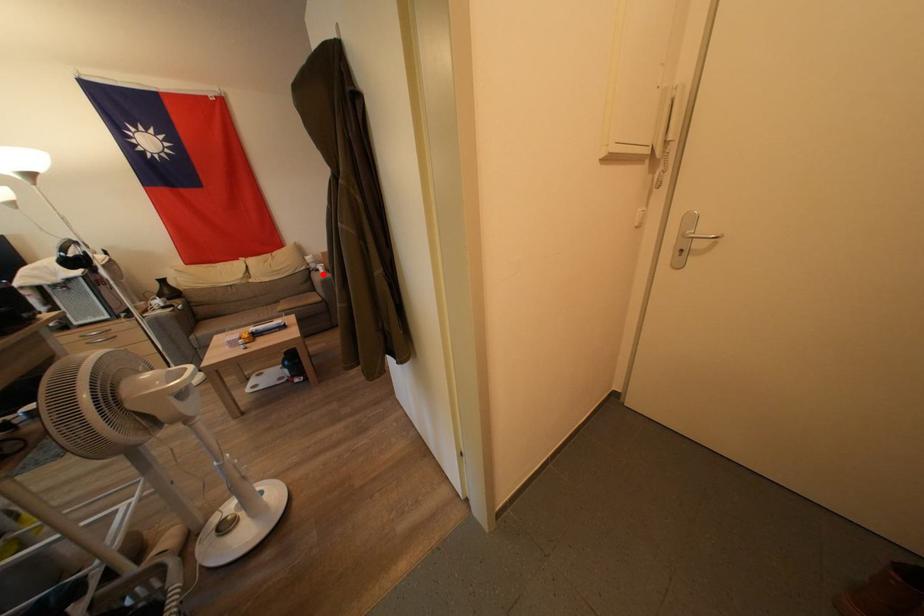
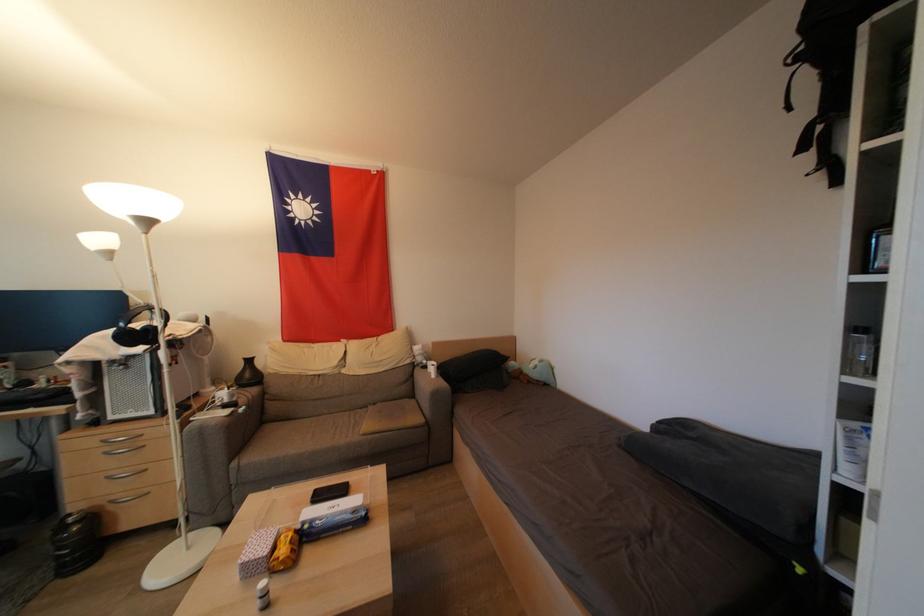
Locate, in the second image, the point that corresponds to the highlighted location in the first image.

(430, 371)